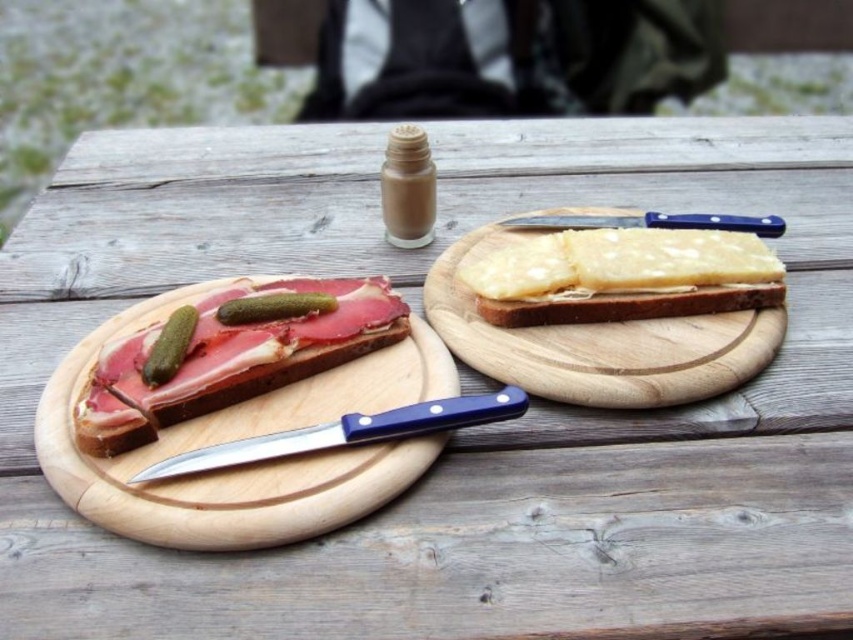
Question: In this image, where is wooden cutting board at center located relative to wooden cutting board at left?

Choices:
 (A) below
 (B) above

Answer: (B)

Question: Considering the real-world distances, which object is farthest from the wooden cutting board at center?

Choices:
 (A) green pickled vegetable at left
 (B) blue polished knife at center

Answer: (A)

Question: Which of the following is the farthest from the observer?

Choices:
 (A) shiny white cheese at center
 (B) wooden cutting board at left

Answer: (A)

Question: Is blue polished knife at center to the left of blue plastic knife at upper right from the viewer's perspective?

Choices:
 (A) no
 (B) yes

Answer: (B)

Question: Observing the image, what is the correct spatial positioning of blue polished knife at center in reference to green pickled vegetable at left?

Choices:
 (A) left
 (B) right

Answer: (B)

Question: Which of these objects is positioned farthest from the wooden cutting board at left?

Choices:
 (A) wooden cutting board at center
 (B) blue plastic knife at upper right

Answer: (B)